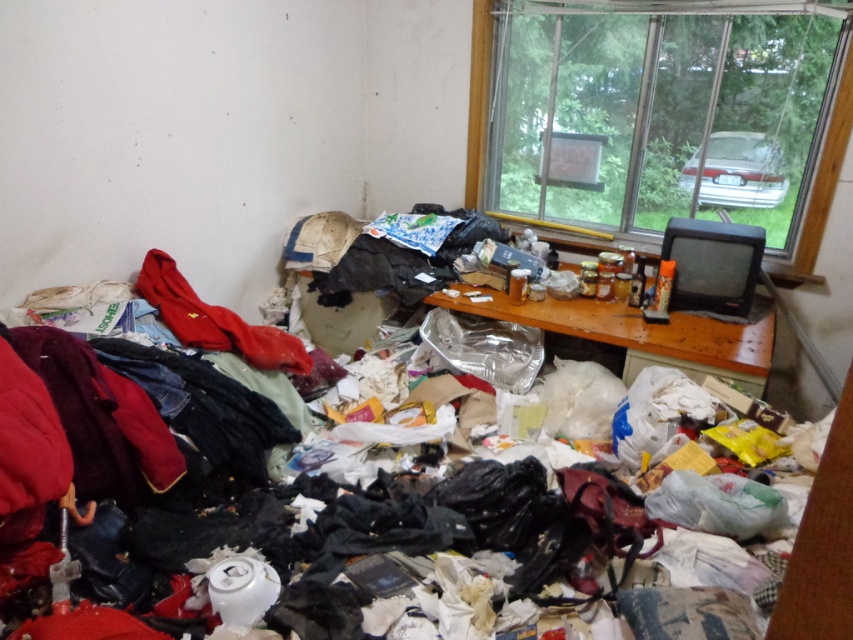
Describe the element at coordinates (80, 412) in the screenshot. The image size is (853, 640). I see `shiny plastic bags at center` at that location.

Is shiny plastic bags at center above transparent glass window at upper right?

Incorrect, shiny plastic bags at center is not positioned above transparent glass window at upper right.

Measure the distance between shiny plastic bags at center and camera.

shiny plastic bags at center is 1.44 meters from camera.

Find the location of a particular element. This screenshot has height=640, width=853. shiny plastic bags at center is located at coordinates (80, 412).

Between point (91, 426) and point (207, 332), which one is positioned behind?

Point (207, 332)

Who is more forward, (x=109, y=552) or (x=152, y=256)?

Positioned in front is point (x=109, y=552).

Locate an element on the screen. shiny plastic bags at center is located at coordinates (80, 412).

Is transparent glass window at upper right to the right of matte red sweatshirt at left from the viewer's perspective?

Correct, you'll find transparent glass window at upper right to the right of matte red sweatshirt at left.

Which is above, transparent glass window at upper right or matte red sweatshirt at left?

transparent glass window at upper right is above.

Which is behind, point (492, 3) or point (167, 323)?

Point (492, 3)

Where is `transparent glass window at upper right`? The height and width of the screenshot is (640, 853). transparent glass window at upper right is located at coordinates (827, 170).